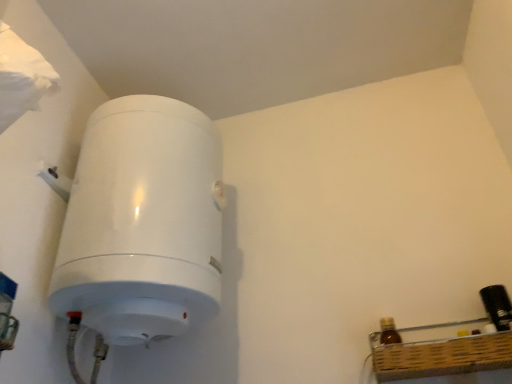
Measure the distance between brown glass bottle at lower right, which appears as the 2th bottle when viewed from the right, and camera.

The distance of brown glass bottle at lower right, which appears as the 2th bottle when viewed from the right, from camera is 34.19 inches.

Image resolution: width=512 pixels, height=384 pixels. Describe the element at coordinates (142, 223) in the screenshot. I see `white glossy water heater at left` at that location.

Where is `black plastic bottle at right, the second bottle in the left-to-right sequence`? This screenshot has height=384, width=512. black plastic bottle at right, the second bottle in the left-to-right sequence is located at coordinates (497, 306).

Considering the positions of objects white glossy water heater at left and black plastic bottle at right, marked as the first bottle in a right-to-left arrangement, in the image provided, who is in front, white glossy water heater at left or black plastic bottle at right, marked as the first bottle in a right-to-left arrangement,?

white glossy water heater at left is in front.

Considering the sizes of objects white glossy water heater at left and black plastic bottle at right, the second bottle in the left-to-right sequence, in the image provided, who is shorter, white glossy water heater at left or black plastic bottle at right, the second bottle in the left-to-right sequence,?

Standing shorter between the two is black plastic bottle at right, the second bottle in the left-to-right sequence.

Is white glossy water heater at left to the right of black plastic bottle at right, the second bottle in the left-to-right sequence, from the viewer's perspective?

No, white glossy water heater at left is not to the right of black plastic bottle at right, the second bottle in the left-to-right sequence.

Is white glossy water heater at left outside of black plastic bottle at right, the second bottle in the left-to-right sequence?

white glossy water heater at left is positioned outside black plastic bottle at right, the second bottle in the left-to-right sequence.

In the scene shown: From the image's perspective, is white glossy water heater at left located above or below brown glass bottle at lower right, which appears as the 2th bottle when viewed from the right?

white glossy water heater at left is situated higher than brown glass bottle at lower right, which appears as the 2th bottle when viewed from the right, in the image.

From the picture: Can you confirm if white glossy water heater at left is smaller than brown glass bottle at lower right, which appears as the 1th bottle when viewed from the left?

No.

Is the depth of white glossy water heater at left greater than that of brown glass bottle at lower right, which appears as the 2th bottle when viewed from the right?

No, it is not.

From the white glossy water heater at left, count 1st bottle to the right and point to it. Please provide its 2D coordinates.

[(389, 332)]

Considering the positions of objects black plastic bottle at right, the second bottle in the left-to-right sequence, and white glossy water heater at left in the image provided, who is behind, black plastic bottle at right, the second bottle in the left-to-right sequence, or white glossy water heater at left?

black plastic bottle at right, the second bottle in the left-to-right sequence, is further away from the camera.

Is black plastic bottle at right, the second bottle in the left-to-right sequence, shorter than white glossy water heater at left?

Correct, black plastic bottle at right, the second bottle in the left-to-right sequence, is not as tall as white glossy water heater at left.

Identify the location of appliance above the black plastic bottle at right, marked as the first bottle in a right-to-left arrangement (from a real-world perspective). The height and width of the screenshot is (384, 512). (x=142, y=223).

Considering the sizes of black plastic bottle at right, marked as the first bottle in a right-to-left arrangement, and white glossy water heater at left in the image, is black plastic bottle at right, marked as the first bottle in a right-to-left arrangement, wider or thinner than white glossy water heater at left?

In the image, black plastic bottle at right, marked as the first bottle in a right-to-left arrangement, appears to be more narrow than white glossy water heater at left.

At what (x,y) coordinates should I click in order to perform the action: click on bottle below the black plastic bottle at right, the second bottle in the left-to-right sequence (from the image's perspective). Please return your answer as a coordinate pair (x, y). Looking at the image, I should click on (389, 332).

From a real-world perspective, is brown glass bottle at lower right, which appears as the 2th bottle when viewed from the right, located beneath black plastic bottle at right, marked as the first bottle in a right-to-left arrangement?

Yes, from a real-world perspective, brown glass bottle at lower right, which appears as the 2th bottle when viewed from the right, is beneath black plastic bottle at right, marked as the first bottle in a right-to-left arrangement.

Considering the relative positions of brown glass bottle at lower right, which appears as the 2th bottle when viewed from the right, and black plastic bottle at right, the second bottle in the left-to-right sequence, in the image provided, is brown glass bottle at lower right, which appears as the 2th bottle when viewed from the right, to the left of black plastic bottle at right, the second bottle in the left-to-right sequence, from the viewer's perspective?

Yes.

Is brown glass bottle at lower right, which appears as the 1th bottle when viewed from the left, not near black plastic bottle at right, marked as the first bottle in a right-to-left arrangement?

That's not correct — brown glass bottle at lower right, which appears as the 1th bottle when viewed from the left, is a little close to black plastic bottle at right, marked as the first bottle in a right-to-left arrangement.

Can you tell me how much black plastic bottle at right, marked as the first bottle in a right-to-left arrangement, and brown glass bottle at lower right, which appears as the 1th bottle when viewed from the left, differ in facing direction?

The facing directions of black plastic bottle at right, marked as the first bottle in a right-to-left arrangement, and brown glass bottle at lower right, which appears as the 1th bottle when viewed from the left, are 0.00108 degrees apart.

Would you say black plastic bottle at right, the second bottle in the left-to-right sequence, contains brown glass bottle at lower right, which appears as the 1th bottle when viewed from the left?

No.

From the image's perspective, is black plastic bottle at right, the second bottle in the left-to-right sequence, beneath brown glass bottle at lower right, which appears as the 1th bottle when viewed from the left?

Incorrect, from the image's perspective, black plastic bottle at right, the second bottle in the left-to-right sequence, is higher than brown glass bottle at lower right, which appears as the 1th bottle when viewed from the left.

Considering the relative positions of black plastic bottle at right, the second bottle in the left-to-right sequence, and brown glass bottle at lower right, which appears as the 2th bottle when viewed from the right, in the image provided, is black plastic bottle at right, the second bottle in the left-to-right sequence, to the right of brown glass bottle at lower right, which appears as the 2th bottle when viewed from the right, from the viewer's perspective?

Correct, you'll find black plastic bottle at right, the second bottle in the left-to-right sequence, to the right of brown glass bottle at lower right, which appears as the 2th bottle when viewed from the right.

Which is less distant, (394, 326) or (109, 286)?

Point (394, 326) is positioned farther from the camera compared to point (109, 286).

How different are the orientations of brown glass bottle at lower right, which appears as the 2th bottle when viewed from the right, and white glossy water heater at left in degrees?

The facing directions of brown glass bottle at lower right, which appears as the 2th bottle when viewed from the right, and white glossy water heater at left are 90.9 degrees apart.

Between brown glass bottle at lower right, which appears as the 2th bottle when viewed from the right, and white glossy water heater at left, which one appears on the right side from the viewer's perspective?

From the viewer's perspective, brown glass bottle at lower right, which appears as the 2th bottle when viewed from the right, appears more on the right side.

Is brown glass bottle at lower right, which appears as the 2th bottle when viewed from the right, smaller than white glossy water heater at left?

Indeed, brown glass bottle at lower right, which appears as the 2th bottle when viewed from the right, has a smaller size compared to white glossy water heater at left.

Identify the location of appliance above the black plastic bottle at right, the second bottle in the left-to-right sequence (from the image's perspective). This screenshot has width=512, height=384. (142, 223).

This screenshot has height=384, width=512. I want to click on the 1st bottle to the right of the white glossy water heater at left, counting from the anchor's position, so pos(389,332).

Which object lies further to the anchor point white glossy water heater at left, brown glass bottle at lower right, which appears as the 2th bottle when viewed from the right, or black plastic bottle at right, the second bottle in the left-to-right sequence?

black plastic bottle at right, the second bottle in the left-to-right sequence, is positioned further to the anchor white glossy water heater at left.

From the image, which object appears to be nearer to brown glass bottle at lower right, which appears as the 1th bottle when viewed from the left, white glossy water heater at left or black plastic bottle at right, the second bottle in the left-to-right sequence?

black plastic bottle at right, the second bottle in the left-to-right sequence, is closer to brown glass bottle at lower right, which appears as the 1th bottle when viewed from the left.

When comparing their distances from black plastic bottle at right, marked as the first bottle in a right-to-left arrangement, does brown glass bottle at lower right, which appears as the 1th bottle when viewed from the left, or white glossy water heater at left seem further?

The object further to black plastic bottle at right, marked as the first bottle in a right-to-left arrangement, is white glossy water heater at left.

Looking at the image, which one is located closer to black plastic bottle at right, marked as the first bottle in a right-to-left arrangement, white glossy water heater at left or brown glass bottle at lower right, which appears as the 2th bottle when viewed from the right?

brown glass bottle at lower right, which appears as the 2th bottle when viewed from the right, is positioned closer to the anchor black plastic bottle at right, marked as the first bottle in a right-to-left arrangement.

Consider the image. Considering their positions, is black plastic bottle at right, marked as the first bottle in a right-to-left arrangement, positioned further to brown glass bottle at lower right, which appears as the 2th bottle when viewed from the right, than white glossy water heater at left?

white glossy water heater at left is further to brown glass bottle at lower right, which appears as the 2th bottle when viewed from the right.

When comparing their distances from white glossy water heater at left, does black plastic bottle at right, the second bottle in the left-to-right sequence, or brown glass bottle at lower right, which appears as the 1th bottle when viewed from the left, seem closer?

brown glass bottle at lower right, which appears as the 1th bottle when viewed from the left.

This screenshot has height=384, width=512. What are the coordinates of `bottle between white glossy water heater at left and black plastic bottle at right, marked as the first bottle in a right-to-left arrangement, from left to right` in the screenshot? It's located at click(389, 332).